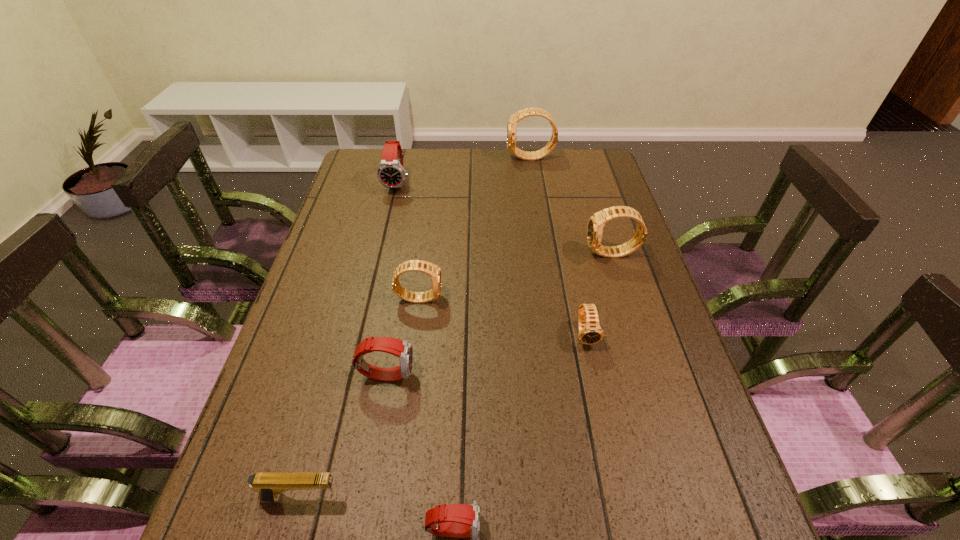
The height and width of the screenshot is (540, 960). Find the location of `the farthest watch`. the farthest watch is located at coordinates (527, 112).

Where is `the farthest object`? The height and width of the screenshot is (540, 960). the farthest object is located at coordinates (527, 112).

Find the location of a particular element. The height and width of the screenshot is (540, 960). the rightmost object is located at coordinates (596, 223).

Where is `the rightmost watch`? The width and height of the screenshot is (960, 540). the rightmost watch is located at coordinates (596, 223).

Find the location of a particular element. This screenshot has width=960, height=540. the seventh nearest object is located at coordinates (391, 174).

You are a GUI agent. You are given a task and a screenshot of the screen. Output one action in this format:
    pyautogui.click(x=<x>, y=<y>)
    Task: Click on the biggest red watch
    
    Given the screenshot: What is the action you would take?
    pyautogui.click(x=391, y=174)

Locate an element on the screen. the fourth farthest watch is located at coordinates (432, 270).

Where is `the third biggest black watch`? Image resolution: width=960 pixels, height=540 pixels. the third biggest black watch is located at coordinates (432, 270).

I want to click on the second nearest red watch, so click(x=402, y=349).

The image size is (960, 540). Identify the location of the sixth farthest object. (402, 349).